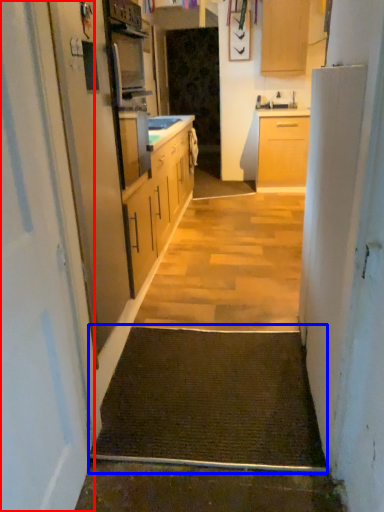
Question: Which object is further to the camera taking this photo, door (highlighted by a red box) or doormat (highlighted by a blue box)?

Choices:
 (A) door
 (B) doormat

Answer: (B)